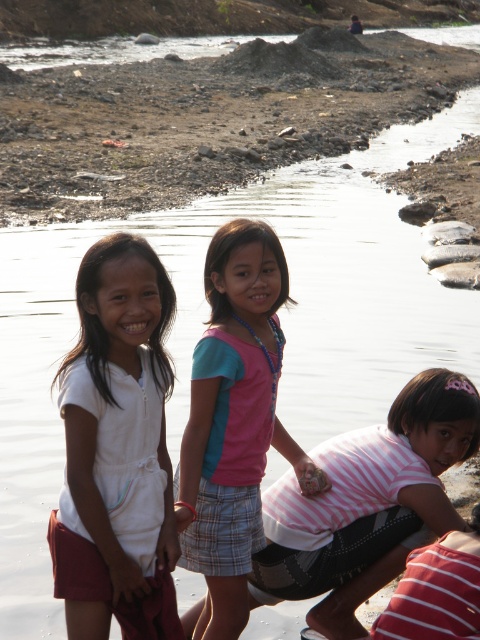
You are a photographer planning to take a picture of the dull brown dirt at upper center and the white cotton dress at center. Since you want both subjects to be in focus, which one should you focus on first to ensure depth of field?

You should focus on the dull brown dirt at upper center first because it is closer to you than the white cotton dress at center, allowing the background subject to stay in focus.

Consider the image. You are a photographer trying to capture a shot of the white cotton dress at center and the dull brown dirt at upper center. Based on their positions, which object is closer to the camera?

The white cotton dress at center is closer to the camera than the dull brown dirt at upper center because the dress is positioned at the center, while the dirt is at the upper center, which is farther away.